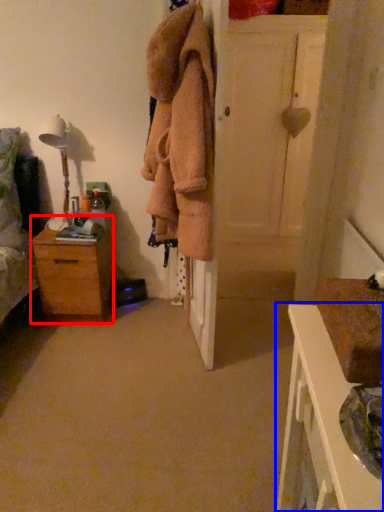
Question: Which point is closer to the camera, chest of drawers (highlighted by a red box) or nightstand (highlighted by a blue box)?

Choices:
 (A) chest of drawers
 (B) nightstand

Answer: (B)